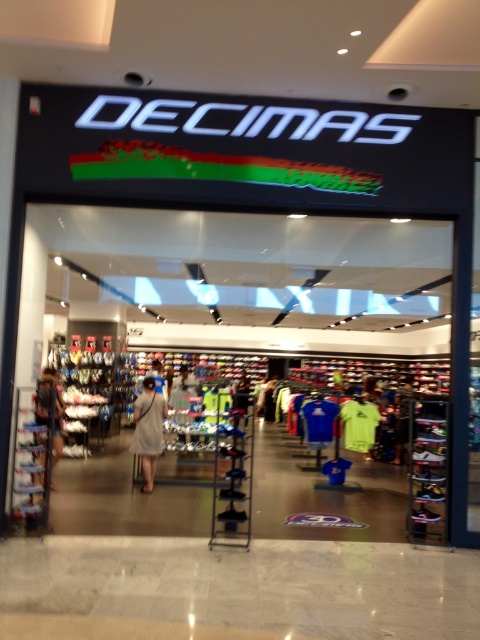
You are a customer looking to buy a dress for a casual event. You see the light beige fabric dress at center and the light gray fabric dress at left. Which dress has a larger size available?

The light beige fabric dress at center is bigger than the light gray fabric dress at left, so the larger size is available for the light beige fabric dress at center.

You are a customer at the DECIMAS store entrance and want to see both the light beige fabric dress at center and the light gray fabric shirt at center. Which one is on top?

The light beige fabric dress at center is positioned over the light gray fabric shirt at center, so the light beige fabric dress at center is on top.